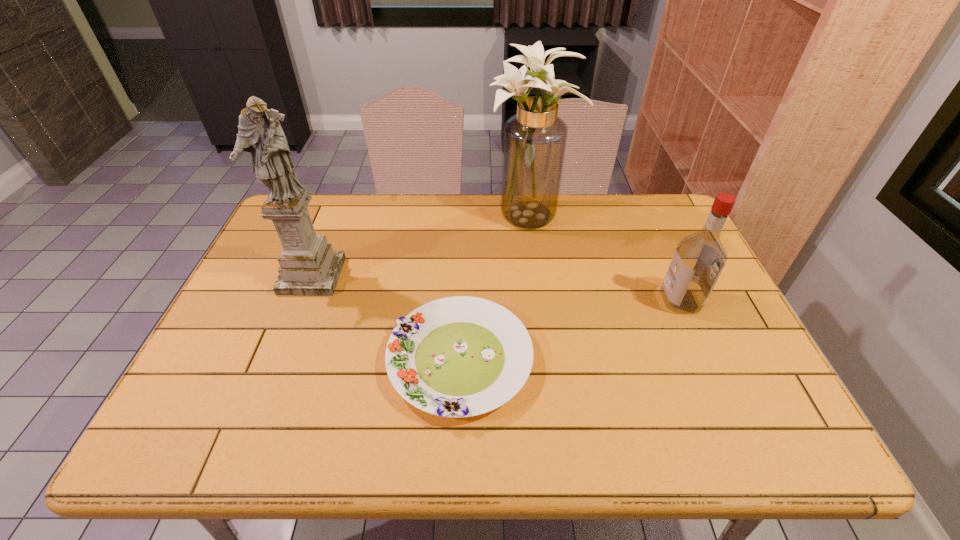
The height and width of the screenshot is (540, 960). I want to click on the farthest object, so click(x=534, y=141).

The height and width of the screenshot is (540, 960). In order to click on the leftmost object in this screenshot , I will do `click(308, 265)`.

Where is `the second shortest object`? The image size is (960, 540). the second shortest object is located at coordinates [x=699, y=258].

The height and width of the screenshot is (540, 960). I want to click on the rightmost object, so click(x=699, y=258).

This screenshot has height=540, width=960. I want to click on the shortest object, so click(x=461, y=356).

You are a GUI agent. You are given a task and a screenshot of the screen. Output one action in this format:
    pyautogui.click(x=<x>, y=<y>)
    Task: Click on the vacant space located 0.300m on the right of the flower arrangement
    The width and height of the screenshot is (960, 540).
    Given the screenshot: What is the action you would take?
    pyautogui.click(x=662, y=218)

What are the coordinates of `vacant space located on the front-facing side of the leftmost object` in the screenshot? It's located at pos(289,333).

The height and width of the screenshot is (540, 960). I want to click on vacant point located 0.180m on the front-facing side of the liquor, so click(x=595, y=301).

Find the location of a particular element. The image size is (960, 540). free spot located on the front-facing side of the liquor is located at coordinates (599, 301).

Find the location of `vacant space located on the front-facing side of the liquor`. vacant space located on the front-facing side of the liquor is located at coordinates click(569, 301).